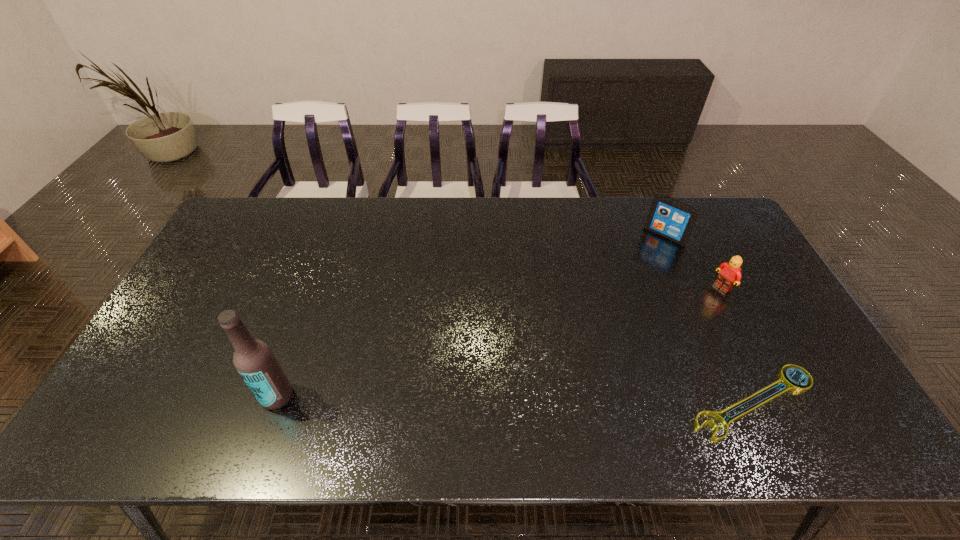
You are a GUI agent. You are given a task and a screenshot of the screen. Output one action in this format:
    pyautogui.click(x=<x>, y=<y>)
    Task: Click on the object at the near right corner
    
    Given the screenshot: What is the action you would take?
    pyautogui.click(x=792, y=385)

In the image, there is a desktop. In order to click on vacant space at the far edge in this screenshot , I will do coord(653,198).

In the image, there is a desktop. Where is `vacant space at the near edge`? The width and height of the screenshot is (960, 540). vacant space at the near edge is located at coordinates (446, 385).

You are a GUI agent. You are given a task and a screenshot of the screen. Output one action in this format:
    pyautogui.click(x=<x>, y=<y>)
    Task: Click on the free space at the left edge of the desktop
    This screenshot has width=960, height=540.
    Given the screenshot: What is the action you would take?
    tap(204, 336)

You are a GUI agent. You are given a task and a screenshot of the screen. Output one action in this format:
    pyautogui.click(x=<x>, y=<y>)
    Task: Click on the free space at the far left corner
    
    Given the screenshot: What is the action you would take?
    pyautogui.click(x=264, y=238)

The height and width of the screenshot is (540, 960). I want to click on blank area at the far right corner, so click(719, 215).

Identify the location of vacant point located between the second farthest object and the shortest object. (738, 345).

Locate an element on the screen. empty space that is in between the Lego and the tallest object is located at coordinates (499, 342).

Find the location of a particular element. The width and height of the screenshot is (960, 540). vacant area that lies between the tallest object and the farthest object is located at coordinates (471, 316).

Find the location of a particular element. The image size is (960, 540). empty space between the Lego and the wrench is located at coordinates (738, 345).